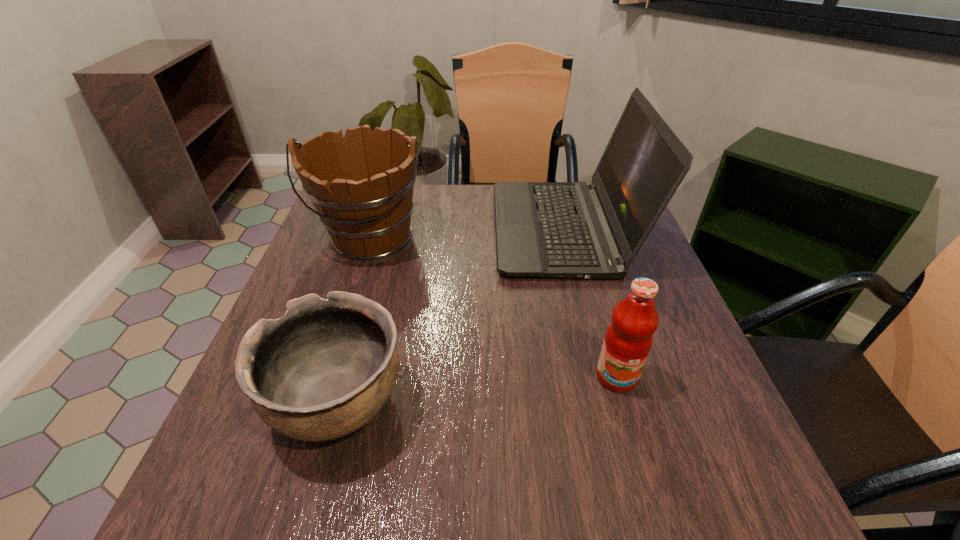
Identify the location of vacant area between the second shortest object and the shortest object. (477, 389).

This screenshot has width=960, height=540. Identify the location of vacant space that is in between the fruit juice and the pottery. (477, 389).

In order to click on free space between the laptop_computer and the wine bucket in this screenshot , I will do `click(468, 233)`.

What are the coordinates of `free spot between the fruit juice and the laptop_computer` in the screenshot? It's located at (589, 303).

Point out which object is positioned as the second nearest to the laptop_computer. Please provide its 2D coordinates. Your answer should be formatted as a tuple, i.e. [(x, y)], where the tuple contains the x and y coordinates of a point satisfying the conditions above.

[(628, 339)]

You are a GUI agent. You are given a task and a screenshot of the screen. Output one action in this format:
    pyautogui.click(x=<x>, y=<y>)
    Task: Click on the third closest object to the wine bucket
    
    Given the screenshot: What is the action you would take?
    pyautogui.click(x=628, y=339)

This screenshot has height=540, width=960. Find the location of `vacant space that satisfies the following two spatial constraints: 1. on the screen of the laptop_computer; 2. with the handle on the wine bucket`. vacant space that satisfies the following two spatial constraints: 1. on the screen of the laptop_computer; 2. with the handle on the wine bucket is located at coordinates (565, 237).

Identify the location of free region that satisfies the following two spatial constraints: 1. on the screen of the laptop_computer; 2. on the front side of the shortest object. Image resolution: width=960 pixels, height=540 pixels. (606, 402).

The height and width of the screenshot is (540, 960). Find the location of `free region that satisfies the following two spatial constraints: 1. with the handle on the wine bucket; 2. on the left side of the shortest object`. free region that satisfies the following two spatial constraints: 1. with the handle on the wine bucket; 2. on the left side of the shortest object is located at coordinates (319, 402).

What are the coordinates of `free space that satisfies the following two spatial constraints: 1. with the handle on the pottery; 2. on the right side of the wine bucket` in the screenshot? It's located at (319, 402).